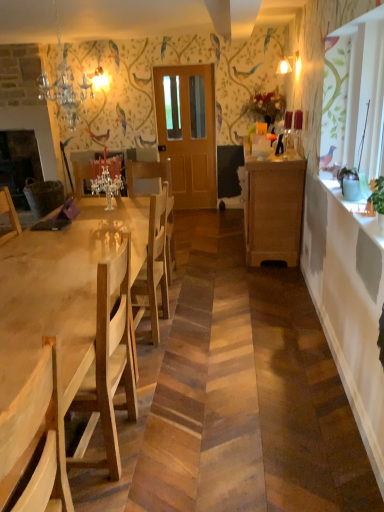
Question: Is crystal glass chandelier at upper left, which is the 1th lamp in left-to-right order, at the right side of light wood table at center?

Choices:
 (A) no
 (B) yes

Answer: (A)

Question: From a real-world perspective, is crystal glass chandelier at upper left, acting as the 2th lamp starting from the back, physically above light wood table at center?

Choices:
 (A) yes
 (B) no

Answer: (A)

Question: Would you say light wood table at center is part of crystal glass chandelier at upper left, acting as the 2th lamp starting from the back,'s contents?

Choices:
 (A) yes
 (B) no

Answer: (B)

Question: Does crystal glass chandelier at upper left, acting as the 2th lamp starting from the back, appear on the left side of light wood table at center?

Choices:
 (A) yes
 (B) no

Answer: (A)

Question: Considering the relative sizes of crystal glass chandelier at upper left, acting as the 2th lamp starting from the back, and light wood table at center in the image provided, is crystal glass chandelier at upper left, acting as the 2th lamp starting from the back, thinner than light wood table at center?

Choices:
 (A) yes
 (B) no

Answer: (A)

Question: Is matte glass lampshade at upper center, the 2th lamp when ordered from left to right, taller or shorter than light wood chair at left?

Choices:
 (A) short
 (B) tall

Answer: (A)

Question: Is point (299, 62) closer or farther from the camera than point (69, 502)?

Choices:
 (A) closer
 (B) farther

Answer: (B)

Question: In the image, is matte glass lampshade at upper center, the second lamp when ordered from front to back, positioned in front of or behind light wood chair at left?

Choices:
 (A) behind
 (B) front

Answer: (A)

Question: Based on their positions, is matte glass lampshade at upper center, the second lamp when ordered from front to back, located to the left or right of light wood chair at left?

Choices:
 (A) left
 (B) right

Answer: (B)

Question: From a real-world perspective, is white glossy counter top at upper right above or below light brown wooden door at center?

Choices:
 (A) below
 (B) above

Answer: (A)

Question: Is point (339, 211) positioned closer to the camera than point (198, 99)?

Choices:
 (A) farther
 (B) closer

Answer: (B)

Question: Looking at their shapes, would you say white glossy counter top at upper right is wider or thinner than light brown wooden door at center?

Choices:
 (A) thin
 (B) wide

Answer: (B)

Question: Considering the positions of white glossy counter top at upper right and light brown wooden door at center in the image, is white glossy counter top at upper right taller or shorter than light brown wooden door at center?

Choices:
 (A) tall
 (B) short

Answer: (B)

Question: Considering the positions of wooden cabinet at right and crystal glass chandelier at upper left, positioned as the 1th lamp in front-to-back order, in the image, is wooden cabinet at right wider or thinner than crystal glass chandelier at upper left, positioned as the 1th lamp in front-to-back order,?

Choices:
 (A) wide
 (B) thin

Answer: (A)

Question: Is wooden cabinet at right to the left or to the right of crystal glass chandelier at upper left, which is counted as the 2th lamp, starting from the top, in the image?

Choices:
 (A) right
 (B) left

Answer: (A)